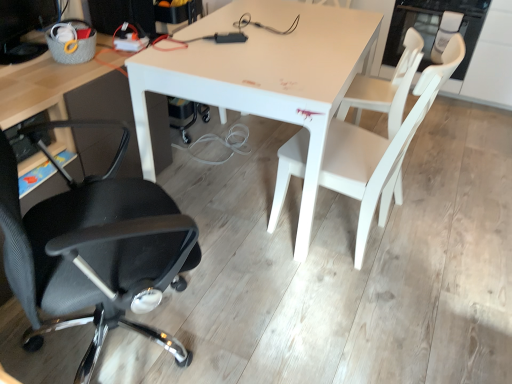
Image resolution: width=512 pixels, height=384 pixels. Find the location of `free space that is to the left of white matte chair at right, acting as the third chair starting from the left`. free space that is to the left of white matte chair at right, acting as the third chair starting from the left is located at coordinates (261, 163).